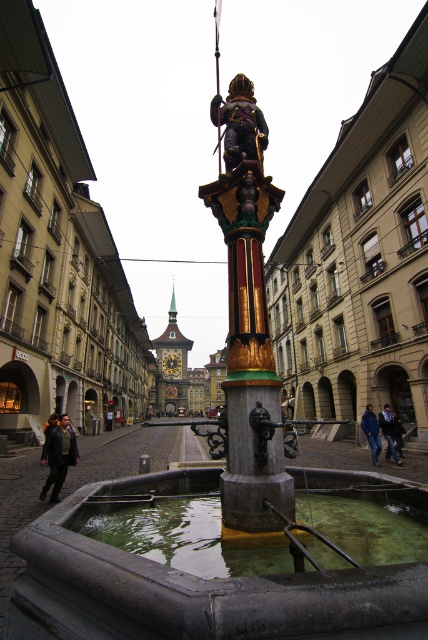
Based on the photo, you are a tourist in the plaza and want to take a photo of the gold clock tower at center and dark blue jeans at lower right. Which object should you zoom in on to capture both in the frame without moving the camera?

The gold clock tower at center is wider than dark blue jeans at lower right, so you should zoom in on the gold clock tower at center to include both in the frame.